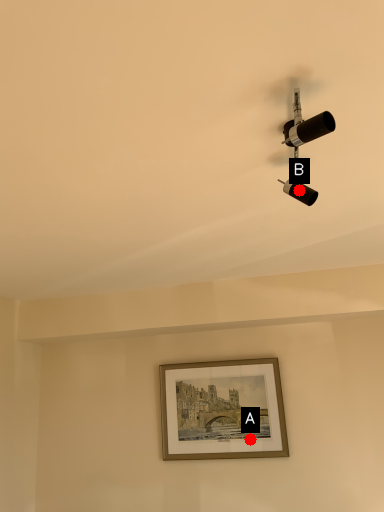
Question: Two points are circled on the image, labeled by A and B beside each circle. Which point appears farthest from the camera in this image?

Choices:
 (A) A is further
 (B) B is further

Answer: (A)